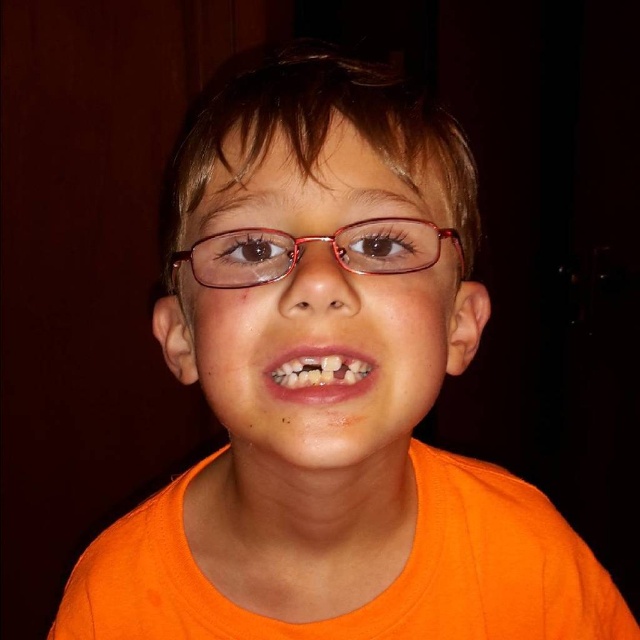
You are a photographer setting up for a portrait shoot. You have two pairs of glasses in front of you on the table. The matte plastic glasses at center and the matte pink plastic glasses at center. You need to choose one that will fit better in a frame where the subject has a narrow face. Which pair should you select?

The matte pink plastic glasses at center should be selected because its width is smaller than the matte plastic glasses at center, making it a better fit for a narrow face.

You are a photographer adjusting the lighting for a portrait. The subject is wearing matte plastic glasses at center and has white glossy teeth at center. You need to ensure that the glasses and teeth are both clearly visible. Given their sizes, which object might require more careful lighting adjustment to avoid glare?

The matte plastic glasses at center has a greater width than the white glossy teeth at center, so it might require more careful lighting adjustment to avoid glare since its larger surface area could reflect more light.